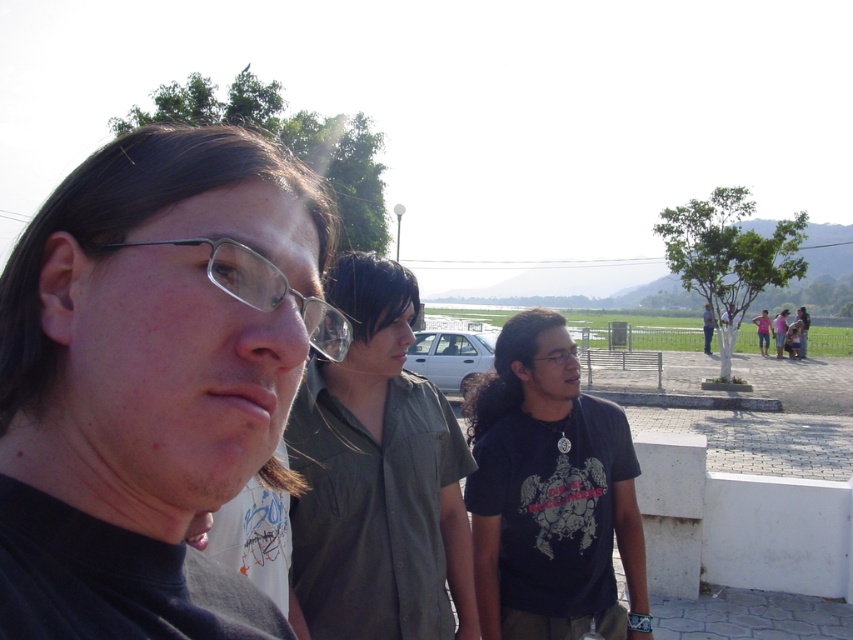
You are a photographer trying to capture a candid shot of the two men in the scene. You notice the green matte shirt at center and the clear plastic glasses at center. Which object is positioned more to the right from your perspective?

The green matte shirt at center is positioned to the right of the clear plastic glasses at center, so the green matte shirt at center is more to the right.